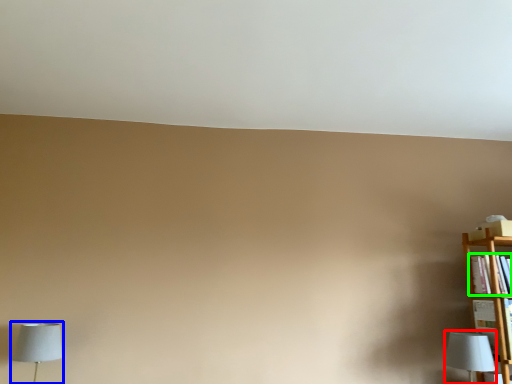
Question: Estimate the real-world distances between objects in this image. Which object is farther from lamp (highlighted by a red box), lamp (highlighted by a blue box) or book (highlighted by a green box)?

Choices:
 (A) lamp
 (B) book

Answer: (A)